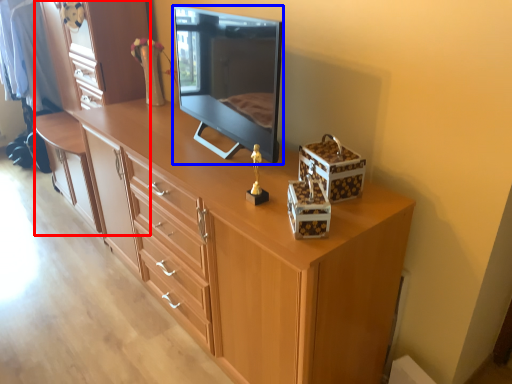
Question: Which of the following is the closest to the observer, dresser (highlighted by a red box) or television (highlighted by a blue box)?

Choices:
 (A) dresser
 (B) television

Answer: (B)